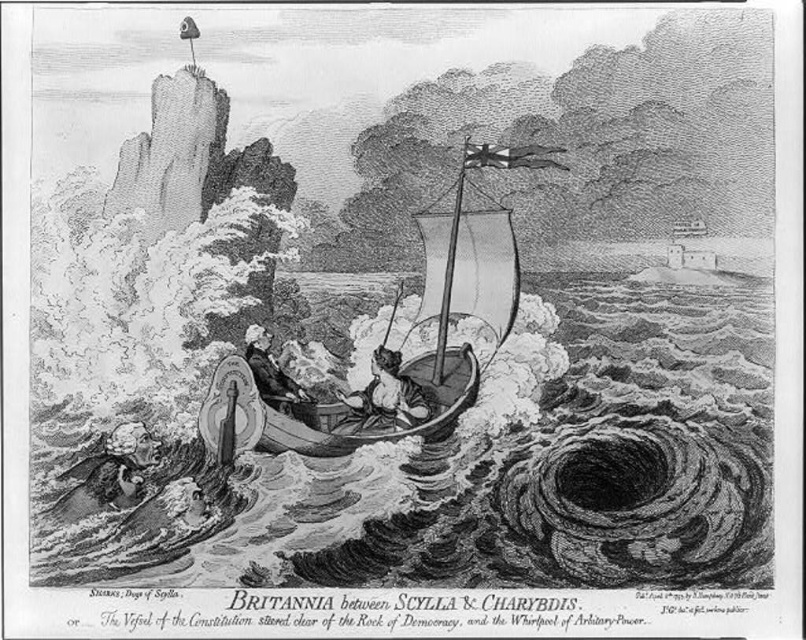
Looking at this image, you are an observer looking at the illustration of Britannia between Scylla and Charybdis. There are two points marked in the image. Which point is closer to you, point (381, 356) or point (269, 385)?

Point (381, 356) is closer to you because it is further to the viewer than point (269, 385).

In the maritime scene depicted in the image, there is a smooth skin woman at center and a smooth leather jacket at center. Which object occupies more space in the image?

The smooth skin woman at center has a larger size compared to the smooth leather jacket at center, so she occupies more space in the image.